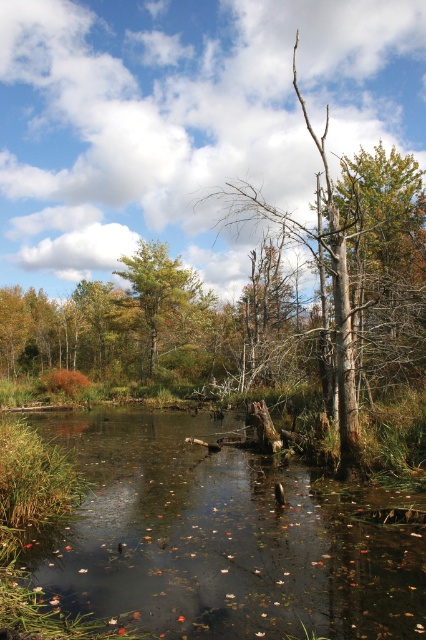
Question: From the image, what is the correct spatial relationship of brown bark tree at center in relation to green matte tree at center?

Choices:
 (A) above
 (B) below

Answer: (A)

Question: Which object is the closest to the green matte tree at center?

Choices:
 (A) brown bark tree at center
 (B) brown murky water at center

Answer: (A)

Question: Does brown murky water at center appear on the left side of green matte tree at center?

Choices:
 (A) yes
 (B) no

Answer: (B)

Question: Which of the following is the farthest from the observer?

Choices:
 (A) green matte tree at center
 (B) brown murky water at center
 (C) brown bark tree at center

Answer: (A)

Question: Estimate the real-world distances between objects in this image. Which object is farther from the brown murky water at center?

Choices:
 (A) brown bark tree at center
 (B) green matte tree at center

Answer: (B)

Question: Can you confirm if brown bark tree at center is smaller than green matte tree at center?

Choices:
 (A) yes
 (B) no

Answer: (B)